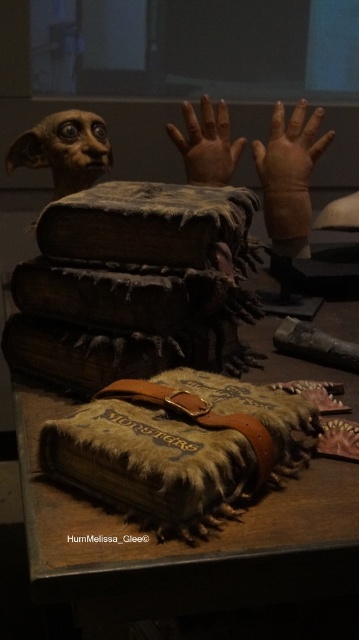
Question: Among these points, which one is nearest to the camera?

Choices:
 (A) (120, 429)
 (B) (272, 204)

Answer: (A)

Question: Is the position of wooden table at center more distant than that of fuzzy brown book at center?

Choices:
 (A) no
 (B) yes

Answer: (A)

Question: Which object is positioned closest to the smooth beige hand at center?

Choices:
 (A) smooth beige creature at upper left
 (B) wooden table at center
 (C) fuzzy leather book at center
 (D) fuzzy brown book at center

Answer: (A)

Question: Which object is positioned farthest from the smooth beige creature at upper left?

Choices:
 (A) wooden table at center
 (B) fuzzy brown book at center

Answer: (B)

Question: Is fuzzy brown book at center closer to the viewer compared to smooth beige creature at upper left?

Choices:
 (A) no
 (B) yes

Answer: (B)

Question: Is leather-like hand at center positioned before smooth beige creature at upper left?

Choices:
 (A) no
 (B) yes

Answer: (A)